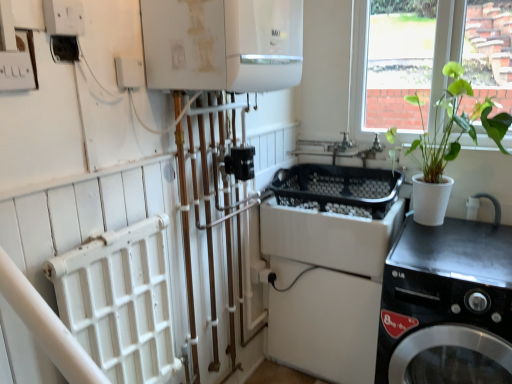
What do you see at coordinates (446, 299) in the screenshot? I see `black glossy washing machine at lower right` at bounding box center [446, 299].

Describe the element at coordinates (424, 62) in the screenshot. I see `transparent glass window at upper right` at that location.

Identify the location of green leafy plant in white pot at right. The width and height of the screenshot is (512, 384). (453, 126).

This screenshot has height=384, width=512. Find the location of `black glossy washing machine at lower right`. black glossy washing machine at lower right is located at coordinates (446, 299).

How many degrees apart are the facing directions of transparent glass window at upper right and white glossy boiler at upper center?

87.3 degrees.

Consider the image. Based on their sizes in the image, would you say transparent glass window at upper right is bigger or smaller than white glossy boiler at upper center?

transparent glass window at upper right is smaller than white glossy boiler at upper center.

Considering the positions of objects transparent glass window at upper right and white glossy boiler at upper center in the image provided, who is more to the left, transparent glass window at upper right or white glossy boiler at upper center?

white glossy boiler at upper center is more to the left.

From a real-world perspective, is transparent glass window at upper right positioned above or below white glossy boiler at upper center?

Clearly, from a real-world perspective, transparent glass window at upper right is below white glossy boiler at upper center.

From the image's perspective, would you say transparent glass window at upper right is positioned over white plastic electric outlet at upper left?

Yes, from the image's perspective, transparent glass window at upper right is on top of white plastic electric outlet at upper left.

Does transparent glass window at upper right contain white plastic electric outlet at upper left?

No, white plastic electric outlet at upper left is not a part of transparent glass window at upper right.

Can you tell me how much transparent glass window at upper right and white plastic electric outlet at upper left differ in facing direction?

transparent glass window at upper right and white plastic electric outlet at upper left are facing 87.6 degrees away from each other.

Considering the sizes of objects transparent glass window at upper right and white plastic electric outlet at upper left in the image provided, who is bigger, transparent glass window at upper right or white plastic electric outlet at upper left?

transparent glass window at upper right is bigger.

Consider the image. Is there a large distance between white glossy boiler at upper center and transparent glass window at upper right?

white glossy boiler at upper center is actually quite close to transparent glass window at upper right.

Considering the sizes of objects white glossy boiler at upper center and transparent glass window at upper right in the image provided, who is shorter, white glossy boiler at upper center or transparent glass window at upper right?

Standing shorter between the two is white glossy boiler at upper center.

This screenshot has width=512, height=384. I want to click on appliance above the transparent glass window at upper right (from a real-world perspective), so click(222, 44).

In terms of size, does white glossy boiler at upper center appear bigger or smaller than transparent glass window at upper right?

Clearly, white glossy boiler at upper center is larger in size than transparent glass window at upper right.

Does white plastic electric outlet at upper left have a greater width compared to transparent glass window at upper right?

No.

Which object is further away from the camera taking this photo, white plastic electric outlet at upper left or transparent glass window at upper right?

transparent glass window at upper right.

From the image's perspective, which one is positioned higher, white plastic electric outlet at upper left or transparent glass window at upper right?

From the image's view, transparent glass window at upper right is above.

Consider the image. Is transparent glass window at upper right with green leafy plant in white pot at right?

No, transparent glass window at upper right is not touching green leafy plant in white pot at right.

From a real-world perspective, relative to green leafy plant in white pot at right, is transparent glass window at upper right vertically above or below?

From a real-world perspective, transparent glass window at upper right is physically above green leafy plant in white pot at right.

From the image's perspective, is transparent glass window at upper right positioned above or below green leafy plant in white pot at right?

transparent glass window at upper right is situated higher than green leafy plant in white pot at right in the image.

Does transparent glass window at upper right have a lesser width compared to green leafy plant in white pot at right?

Correct, the width of transparent glass window at upper right is less than that of green leafy plant in white pot at right.

Does point (488, 347) appear closer or farther from the camera than point (198, 80)?

Clearly, point (488, 347) is more distant from the camera than point (198, 80).

Is black glossy washing machine at lower right facing away from white glossy boiler at upper center?

No, black glossy washing machine at lower right is not facing away from white glossy boiler at upper center.

Which is more to the right, black glossy washing machine at lower right or white glossy boiler at upper center?

black glossy washing machine at lower right.

Is black glossy washing machine at lower right situated inside white glossy boiler at upper center or outside?

black glossy washing machine at lower right is outside white glossy boiler at upper center.

Is green leafy plant in white pot at right taller or shorter than black glossy washing machine at lower right?

Considering their sizes, green leafy plant in white pot at right has less height than black glossy washing machine at lower right.

From a real-world perspective, which object stands above the other?

green leafy plant in white pot at right is physically above.

From the image's perspective, relative to black glossy washing machine at lower right, is green leafy plant in white pot at right above or below?

Clearly, from the image's perspective, green leafy plant in white pot at right is above black glossy washing machine at lower right.

Is green leafy plant in white pot at right facing away from black glossy washing machine at lower right?

No.

Identify the location of window on the right of the white glossy boiler at upper center. The image size is (512, 384). (424, 62).

Find the location of a particular element. window above the white plastic electric outlet at upper left (from the image's perspective) is located at coordinates (424, 62).

Considering their positions, is black glossy washing machine at lower right positioned closer to transparent glass window at upper right than green leafy plant in white pot at right?

green leafy plant in white pot at right is positioned closer to the anchor transparent glass window at upper right.

Based on the photo, based on their spatial positions, is white plastic electric outlet at upper left or green leafy plant in white pot at right closer to transparent glass window at upper right?

green leafy plant in white pot at right.

Looking at the image, which one is located further to transparent glass window at upper right, black glossy washing machine at lower right or white plastic electric outlet at upper left?

white plastic electric outlet at upper left is further to transparent glass window at upper right.

Which object lies nearer to the anchor point white plastic electric outlet at upper left, transparent glass window at upper right or white glossy boiler at upper center?

white glossy boiler at upper center is positioned closer to the anchor white plastic electric outlet at upper left.

Based on their spatial positions, is white plastic electric outlet at upper left or black glossy washing machine at lower right further from transparent glass window at upper right?

white plastic electric outlet at upper left lies further to transparent glass window at upper right than the other object.

Which object lies nearer to the anchor point transparent glass window at upper right, white plastic electric outlet at upper left or white glossy boiler at upper center?

white glossy boiler at upper center.

Based on their spatial positions, is green leafy plant in white pot at right or transparent glass window at upper right closer to white glossy boiler at upper center?

Based on the image, green leafy plant in white pot at right appears to be nearer to white glossy boiler at upper center.

From the image, which object appears to be farther from transparent glass window at upper right, green leafy plant in white pot at right or black glossy washing machine at lower right?

black glossy washing machine at lower right is positioned further to the anchor transparent glass window at upper right.

Find the location of a particular element. appliance between white plastic electric outlet at upper left and green leafy plant in white pot at right in the horizontal direction is located at coordinates (222, 44).

Image resolution: width=512 pixels, height=384 pixels. Find the location of `houseplant between transparent glass window at upper right and black glossy washing machine at lower right in the vertical direction`. houseplant between transparent glass window at upper right and black glossy washing machine at lower right in the vertical direction is located at coordinates (453, 126).

At what (x,y) coordinates should I click in order to perform the action: click on washing machine between white plastic electric outlet at upper left and transparent glass window at upper right. Please return your answer as a coordinate pair (x, y). This screenshot has height=384, width=512. Looking at the image, I should click on pos(446,299).

In order to click on appliance between white plastic electric outlet at upper left and black glossy washing machine at lower right in the horizontal direction in this screenshot , I will do `click(222, 44)`.